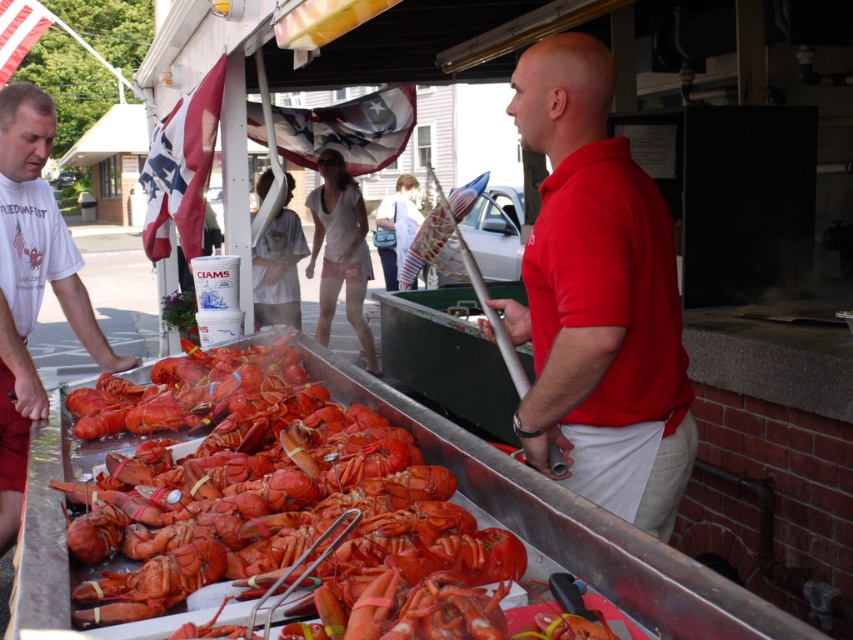
Does red cotton shirt at center appear on the left side of white t-shirt at left?

No, red cotton shirt at center is not to the left of white t-shirt at left.

Image resolution: width=853 pixels, height=640 pixels. Describe the element at coordinates (598, 298) in the screenshot. I see `red cotton shirt at center` at that location.

Which is behind, point (608, 339) or point (1, 316)?

The point (1, 316) is behind.

The width and height of the screenshot is (853, 640). I want to click on red cotton shirt at center, so click(598, 298).

Between point (241, 504) and point (13, 307), which one is positioned behind?

The point (13, 307) is behind.

Can you confirm if shiny red lobster at center is wider than white t-shirt at left?

Yes, shiny red lobster at center is wider than white t-shirt at left.

This screenshot has height=640, width=853. I want to click on shiny red lobster at center, so click(x=267, y=493).

Who is more distant from viewer, (241,474) or (677,408)?

Positioned behind is point (677,408).

How much distance is there between shiny red lobster at center and red cotton shirt at center?

The distance of shiny red lobster at center from red cotton shirt at center is 28.71 inches.

Between point (413, 492) and point (564, 397), which one is positioned in front?

Point (413, 492) is more forward.

Locate an element on the screen. Image resolution: width=853 pixels, height=640 pixels. shiny red lobster at center is located at coordinates (267, 493).